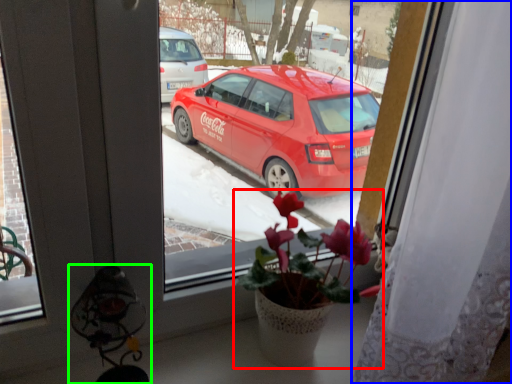
Question: Which object is the farthest from houseplant (highlighted by a red box)? Choose among these: curtain (highlighted by a blue box) or lamp (highlighted by a green box).

Choices:
 (A) curtain
 (B) lamp

Answer: (B)